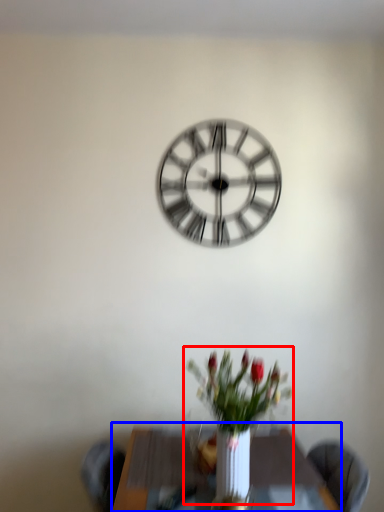
Question: Which object is further to the camera taking this photo, floral arrangement (highlighted by a red box) or table (highlighted by a blue box)?

Choices:
 (A) floral arrangement
 (B) table

Answer: (B)